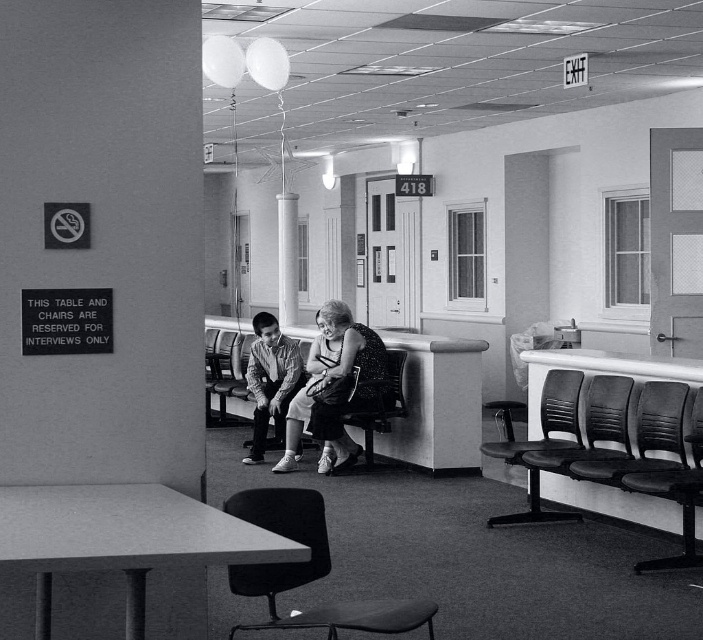
You are a visitor in this waiting area and need to sit down. There is a striped cotton shirt at center and a black plastic chair at lower right. Which object is taller and can you sit on it?

The striped cotton shirt at center is taller than the black plastic chair at lower right. However, you cannot sit on the striped cotton shirt at center as it is a garment and not a seating option. The black plastic chair at lower right is meant for sitting.